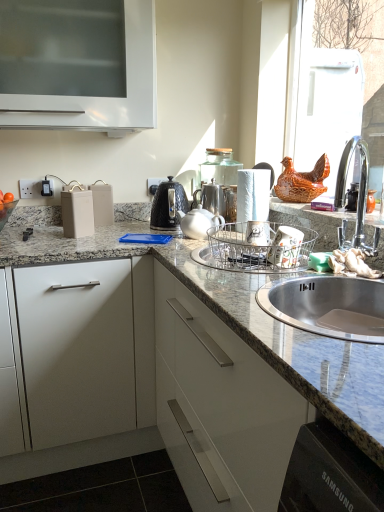
Question: From the image's perspective, is white matte paper towel at center positioned above or below metallic silver dish rack at sink, which is counted as the 3th appliance, starting from the right?

Choices:
 (A) above
 (B) below

Answer: (A)

Question: Considering the positions of white matte paper towel at center and metallic silver dish rack at sink, which is the second appliance from left to right, in the image, is white matte paper towel at center wider or thinner than metallic silver dish rack at sink, which is the second appliance from left to right,?

Choices:
 (A) thin
 (B) wide

Answer: (A)

Question: Based on their relative distances, which object is farther from the black plastic electric outlet at center, which appears as the first electric outlet when viewed from the right?

Choices:
 (A) granite at center
 (B) white glossy cabinet at upper left
 (C) metallic silver dish rack at sink, which is counted as the 3th appliance, starting from the right
 (D) matte white battery at left, which is the 4th appliance in right-to-left order
 (E) white glossy teapot at center

Answer: (A)

Question: Which of these objects is positioned farthest from the white matte paper towel at center?

Choices:
 (A) matte ceramic mugs at center, which appears as the 2th appliance when viewed from the right
 (B) white matte drawer at left
 (C) granite at center
 (D) matte white battery at left, which is the 4th appliance in right-to-left order
 (E) white glossy teapot at center

Answer: (C)